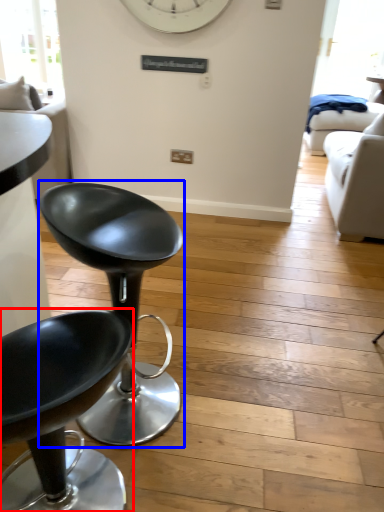
Question: Which object appears farthest to the camera in this image, chair (highlighted by a red box) or chair (highlighted by a blue box)?

Choices:
 (A) chair
 (B) chair

Answer: (B)